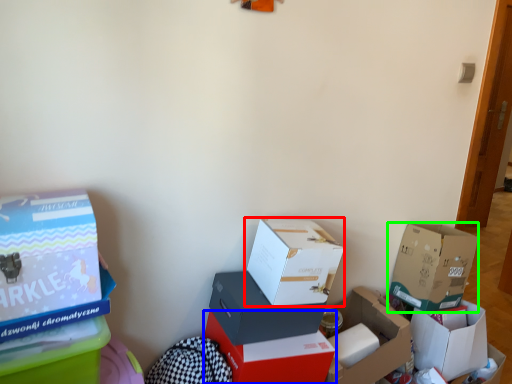
Question: Which object is positioned farthest from box (highlighted by a red box)? Select from box (highlighted by a blue box) and box (highlighted by a green box).

Choices:
 (A) box
 (B) box

Answer: (B)